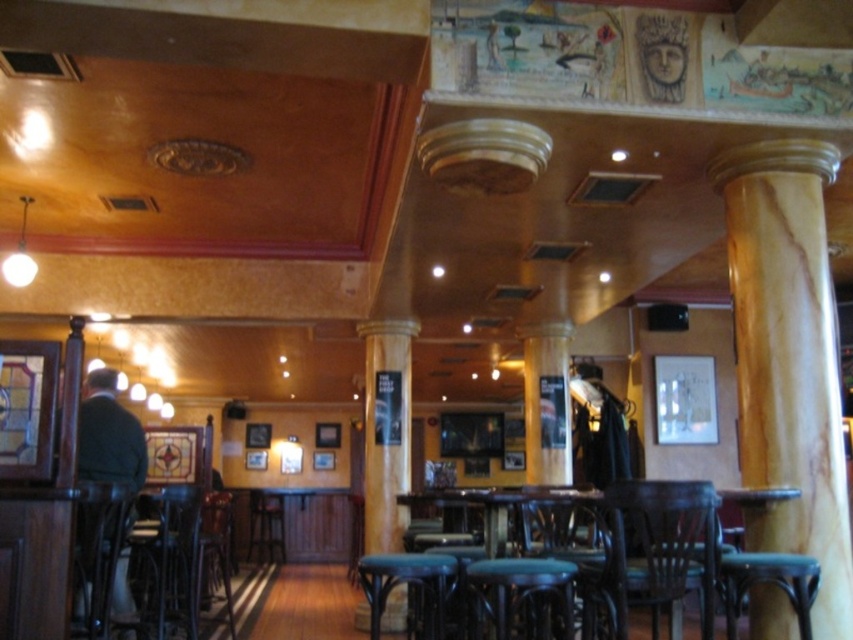
Question: Among these objects, which one is nearest to the camera?

Choices:
 (A) wooden bar stool at center
 (B) dark green sweater at left
 (C) wooden table at center
 (D) dark brown wood bar stool at center

Answer: (C)

Question: Which object appears farthest from the camera in this image?

Choices:
 (A) wooden column at center
 (B) wooden textured chair at center

Answer: (A)

Question: Considering the relative positions of wooden chair at center and dark brown wood bar stool at center in the image provided, where is wooden chair at center located with respect to dark brown wood bar stool at center?

Choices:
 (A) below
 (B) above

Answer: (A)

Question: Which is nearer to the wooden stool at lower right?

Choices:
 (A) wooden chair at center
 (B) green fabric stool at center
 (C) wooden bar stool at center

Answer: (A)

Question: Is wooden chair at center to the right of wooden barstool at lower left from the viewer's perspective?

Choices:
 (A) no
 (B) yes

Answer: (B)

Question: From the image, what is the correct spatial relationship of wooden chair at center in relation to wooden stool at lower right?

Choices:
 (A) right
 (B) left

Answer: (B)